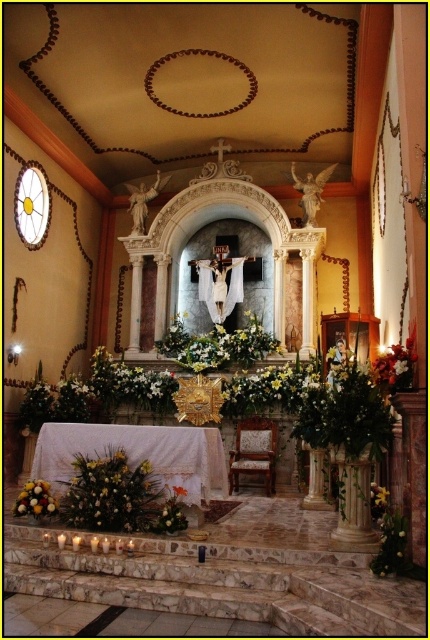
You are a florist who needs to arrange flowers in a straight line between the white silk flowers at right and the yellow matte flower at lower right. What is the minimum distance you need to cover to place them in a straight line?

The minimum distance you need to cover to place the white silk flowers at right and the yellow matte flower at lower right in a straight line is 25.24 feet, as they are already 25.24 feet apart from each other.